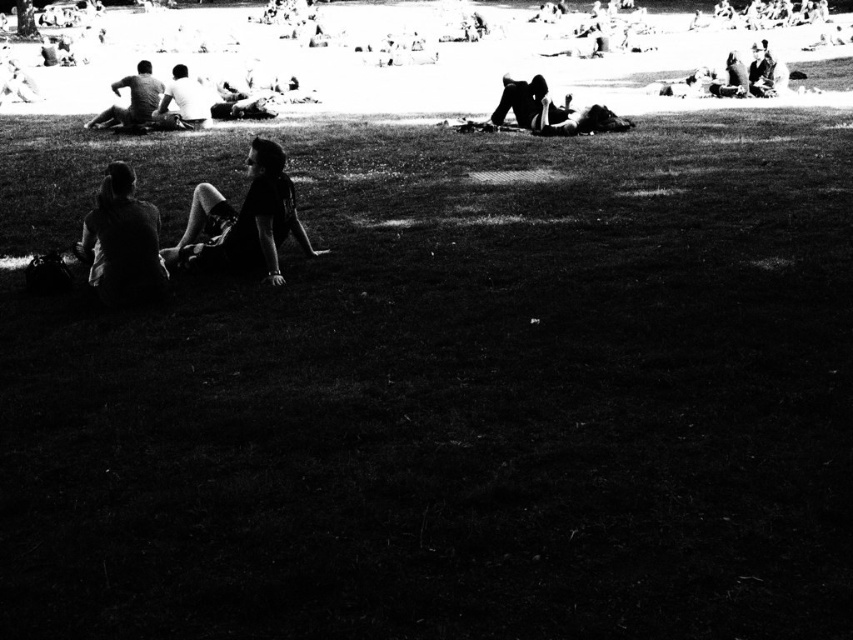
Between dark fabric person at center and white matte shirt at upper center, which one appears on the right side from the viewer's perspective?

From the viewer's perspective, dark fabric person at center appears more on the right side.

Is point (541, 92) positioned before point (200, 88)?

That is True.

Identify the location of dark fabric person at center. Image resolution: width=853 pixels, height=640 pixels. point(527,104).

Does dark fabric pants at center have a smaller size compared to dark fabric person at center?

Incorrect, dark fabric pants at center is not smaller in size than dark fabric person at center.

Is dark fabric pants at center wider than dark fabric person at center?

Indeed, dark fabric pants at center has a greater width compared to dark fabric person at center.

Is point (315, 257) positioned behind point (517, 92)?

No, it is not.

Identify the location of dark fabric pants at center. The width and height of the screenshot is (853, 640). (242, 220).

Can you confirm if dark fabric pants at center is wider than dark gray shirt at upper left?

No.

Who is positioned more to the left, dark fabric pants at center or dark gray shirt at upper left?

dark gray shirt at upper left is more to the left.

This screenshot has height=640, width=853. Describe the element at coordinates (242, 220) in the screenshot. I see `dark fabric pants at center` at that location.

This screenshot has height=640, width=853. Identify the location of dark fabric pants at center. (x=242, y=220).